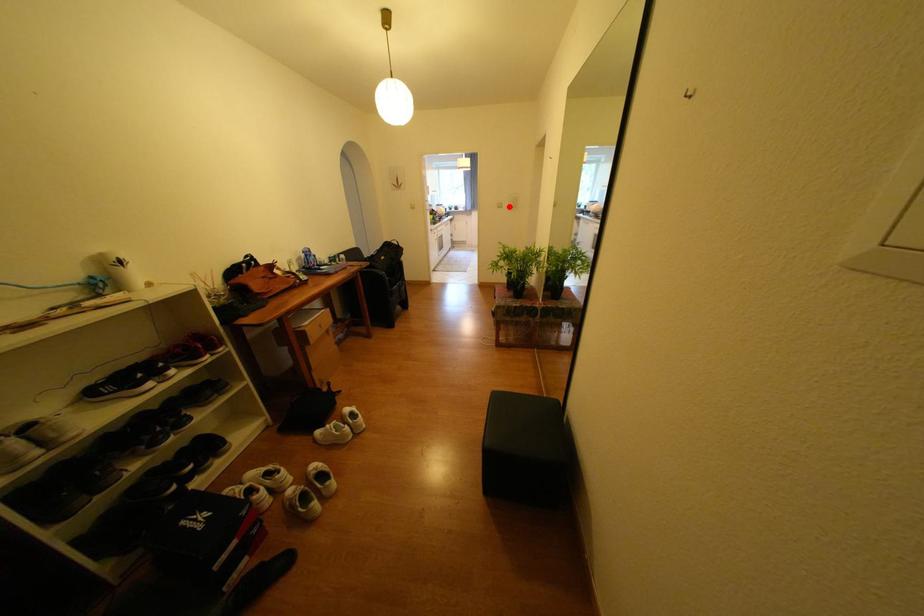
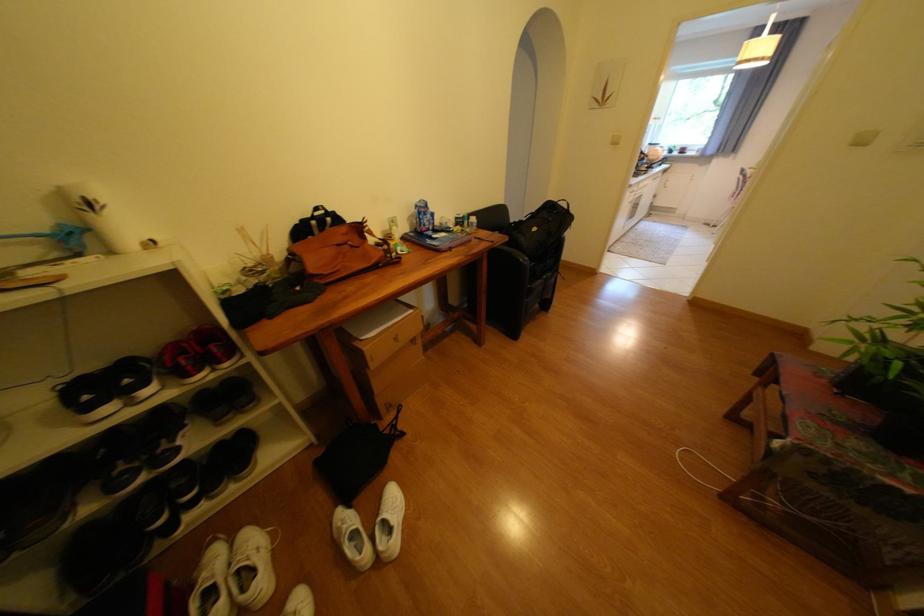
The point at the highlighted location is marked in the first image. Where is the corresponding point in the second image?

(872, 142)